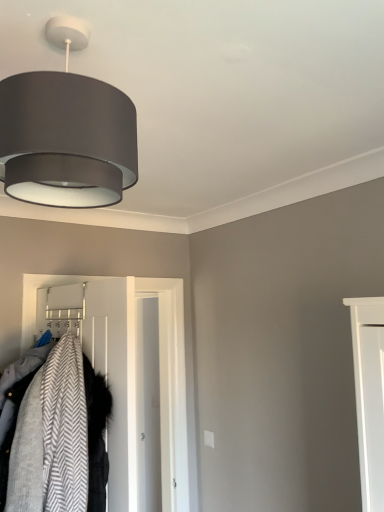
In order to face white smooth door at center, should I rotate leftwards or rightwards?

Rotate your view left by about 4.982°.

This screenshot has height=512, width=384. Identify the location of white smooth door at center. (171, 388).

Describe the element at coordinates (57, 437) in the screenshot. This screenshot has width=384, height=512. I see `gray herringbone fabric coat at left` at that location.

Locate an element on the screen. This screenshot has width=384, height=512. gray herringbone fabric coat at left is located at coordinates (57, 437).

Identify the location of white plastic hanger at center. (134, 376).

At what (x,y) coordinates should I click in order to perform the action: click on white smooth door at center. Please return your answer as a coordinate pair (x, y). The width and height of the screenshot is (384, 512). Looking at the image, I should click on (171, 388).

Can we say matte gray fabric lampshade at upper left lies outside white smooth door at center?

matte gray fabric lampshade at upper left is positioned outside white smooth door at center.

From a real-world perspective, is matte gray fabric lampshade at upper left on top of white smooth door at center?

Yes.

Find the location of `lamp in front of the white smooth door at center`. lamp in front of the white smooth door at center is located at coordinates 66,133.

Considering the sizes of objects matte gray fabric lampshade at upper left and white smooth door at center in the image provided, who is wider, matte gray fabric lampshade at upper left or white smooth door at center?

matte gray fabric lampshade at upper left is wider.

In terms of size, does white smooth door at center appear bigger or smaller than matte gray fabric lampshade at upper left?

Clearly, white smooth door at center is larger in size than matte gray fabric lampshade at upper left.

From a real-world perspective, is white smooth door at center below matte gray fabric lampshade at upper left?

Yes, from a real-world perspective, white smooth door at center is beneath matte gray fabric lampshade at upper left.

Is white smooth door at center taller than matte gray fabric lampshade at upper left?

Yes.

Is white smooth door at center in front of or behind matte gray fabric lampshade at upper left in the image?

In the image, white smooth door at center appears behind matte gray fabric lampshade at upper left.

Between white plastic hanger at center and gray herringbone fabric coat at left, which one has larger size?

white plastic hanger at center.

Considering the sizes of objects white plastic hanger at center and gray herringbone fabric coat at left in the image provided, who is shorter, white plastic hanger at center or gray herringbone fabric coat at left?

With less height is gray herringbone fabric coat at left.

Which is behind, white plastic hanger at center or gray herringbone fabric coat at left?

white plastic hanger at center is more distant.

Consider the image. Is white plastic hanger at center shorter than white smooth door at center?

Yes.

Is white plastic hanger at center located outside white smooth door at center?

Yes, white plastic hanger at center is outside of white smooth door at center.

Based on their positions, is white plastic hanger at center located to the left or right of white smooth door at center?

white plastic hanger at center is positioned on white smooth door at center's left side.

From the image's perspective, is white smooth door at center on top of gray herringbone fabric coat at left?

No.

Considering the relative sizes of white smooth door at center and gray herringbone fabric coat at left in the image provided, is white smooth door at center wider than gray herringbone fabric coat at left?

Incorrect, the width of white smooth door at center does not surpass that of gray herringbone fabric coat at left.

Is gray herringbone fabric coat at left touching white smooth door at center?

No, gray herringbone fabric coat at left is not beside white smooth door at center.

Where is `laundry above the white smooth door at center (from the image's perspective)`? The width and height of the screenshot is (384, 512). laundry above the white smooth door at center (from the image's perspective) is located at coordinates click(x=57, y=437).

Who is bigger, gray herringbone fabric coat at left or white smooth door at center?

Bigger between the two is white smooth door at center.

From a real-world perspective, which is physically below, gray herringbone fabric coat at left or white smooth door at center?

white smooth door at center is physically lower.

Is gray herringbone fabric coat at left closer to camera compared to white plastic hanger at center?

Yes, it is in front of white plastic hanger at center.

Is gray herringbone fabric coat at left looking in the opposite direction of white plastic hanger at center?

gray herringbone fabric coat at left does not have its back to white plastic hanger at center.

Measure the distance from gray herringbone fabric coat at left to white plastic hanger at center.

A distance of 3.34 feet exists between gray herringbone fabric coat at left and white plastic hanger at center.

At what (x,y) coordinates should I click in order to perform the action: click on door located underneath the matte gray fabric lampshade at upper left (from a real-world perspective). Please return your answer as a coordinate pair (x, y). This screenshot has height=512, width=384. Looking at the image, I should click on (171, 388).

Find the location of a particular element. door on the left side of matte gray fabric lampshade at upper left is located at coordinates (171, 388).

Looking at the image, which one is located further to white smooth door at center, gray herringbone fabric coat at left or matte gray fabric lampshade at upper left?

matte gray fabric lampshade at upper left.

When comparing their distances from white plastic hanger at center, does matte gray fabric lampshade at upper left or white smooth door at center seem further?

matte gray fabric lampshade at upper left lies further to white plastic hanger at center than the other object.

Considering their positions, is white smooth door at center positioned closer to gray herringbone fabric coat at left than matte gray fabric lampshade at upper left?

matte gray fabric lampshade at upper left is closer to gray herringbone fabric coat at left.

Considering their positions, is white plastic hanger at center positioned further to gray herringbone fabric coat at left than matte gray fabric lampshade at upper left?

The object further to gray herringbone fabric coat at left is white plastic hanger at center.

From the image, which object appears to be nearer to white plastic hanger at center, white smooth door at center or matte gray fabric lampshade at upper left?

Based on the image, white smooth door at center appears to be nearer to white plastic hanger at center.

Which object lies nearer to the anchor point gray herringbone fabric coat at left, matte gray fabric lampshade at upper left or white smooth door at center?

matte gray fabric lampshade at upper left.

In the scene shown: Estimate the real-world distances between objects in this image. Which object is closer to matte gray fabric lampshade at upper left, white plastic hanger at center or gray herringbone fabric coat at left?

gray herringbone fabric coat at left lies closer to matte gray fabric lampshade at upper left than the other object.

From the image, which object appears to be farther from white smooth door at center, gray herringbone fabric coat at left or white plastic hanger at center?

The object further to white smooth door at center is gray herringbone fabric coat at left.

Find the location of a particular element. The image size is (384, 512). laundry positioned between matte gray fabric lampshade at upper left and white smooth door at center from near to far is located at coordinates (57, 437).

Image resolution: width=384 pixels, height=512 pixels. I want to click on closet between gray herringbone fabric coat at left and white smooth door at center along the z-axis, so click(134, 376).

Where is `laundry located between matte gray fabric lampshade at upper left and white plastic hanger at center in the depth direction`? This screenshot has height=512, width=384. laundry located between matte gray fabric lampshade at upper left and white plastic hanger at center in the depth direction is located at coordinates (57, 437).

Where is `closet between matte gray fabric lampshade at upper left and white smooth door at center from front to back`? closet between matte gray fabric lampshade at upper left and white smooth door at center from front to back is located at coordinates (134, 376).